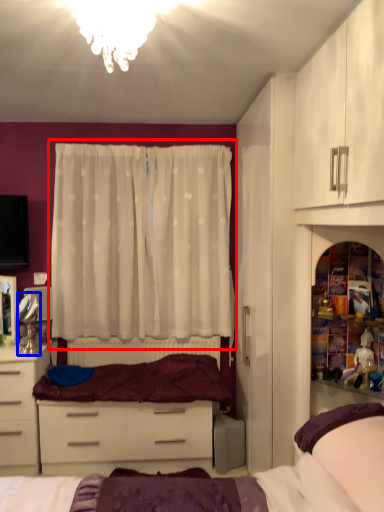
Question: Which point is further to the camera, curtain (highlighted by a red box) or mirror (highlighted by a blue box)?

Choices:
 (A) curtain
 (B) mirror

Answer: (A)